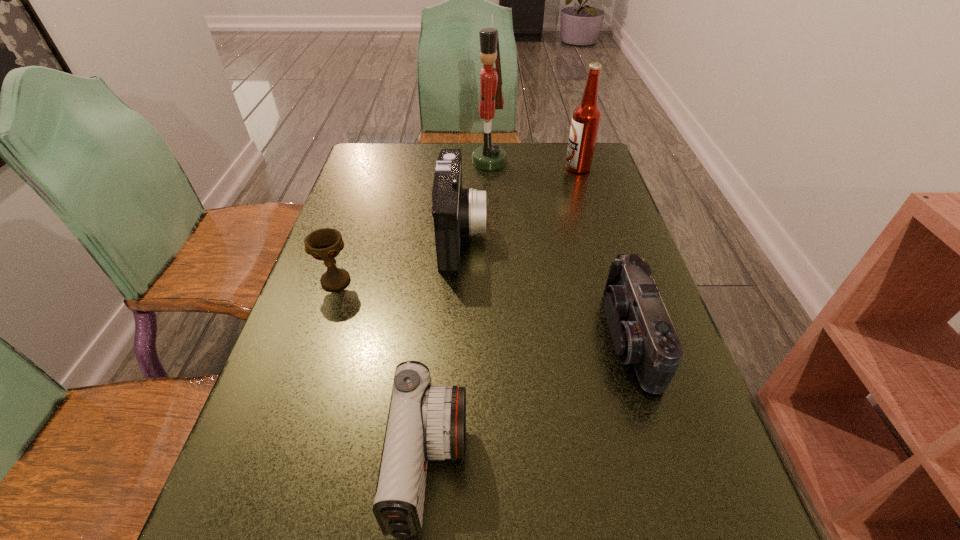
Identify the location of vacant area that lies between the nutcracker and the leftmost object. Image resolution: width=960 pixels, height=540 pixels. (413, 221).

Find the location of a particular element. The image size is (960, 540). vacant area that lies between the chalice and the third tallest object is located at coordinates (398, 257).

The image size is (960, 540). I want to click on free area in between the leftmost object and the rightmost camcorder, so click(x=483, y=309).

Find the location of a particular element. blank region between the fifth shortest object and the tallest object is located at coordinates (534, 165).

Locate an element on the screen. This screenshot has height=540, width=960. free space that is in between the nutcracker and the rightmost camcorder is located at coordinates (559, 249).

Locate which object ranks in proximity to the fourth shortest object. Please provide its 2D coordinates. Your answer should be formatted as a tuple, i.e. [(x, y)], where the tuple contains the x and y coordinates of a point satisfying the conditions above.

[(490, 156)]

I want to click on the fifth closest object to the fourth shortest object, so click(x=424, y=422).

This screenshot has height=540, width=960. Find the location of `camcorder identified as the closest to the nearest camcorder`. camcorder identified as the closest to the nearest camcorder is located at coordinates (642, 333).

I want to click on camcorder that is the second closest to the farthest camcorder, so click(x=424, y=422).

I want to click on vacant region that satisfies the following two spatial constraints: 1. on the label side of the second tallest object; 2. on the front side of the chalice, so click(x=613, y=280).